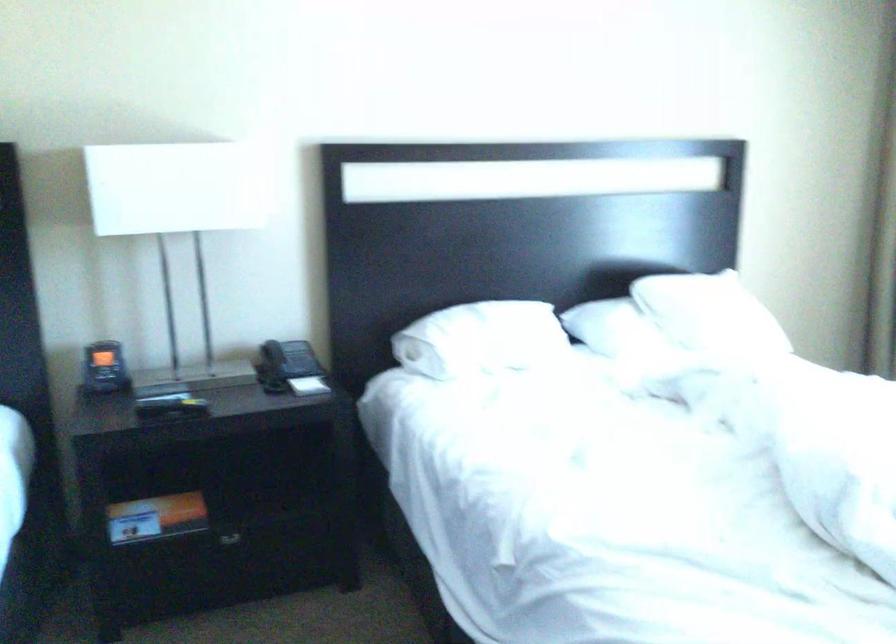
Locate an element on the screen. telephone handset is located at coordinates (273, 360).